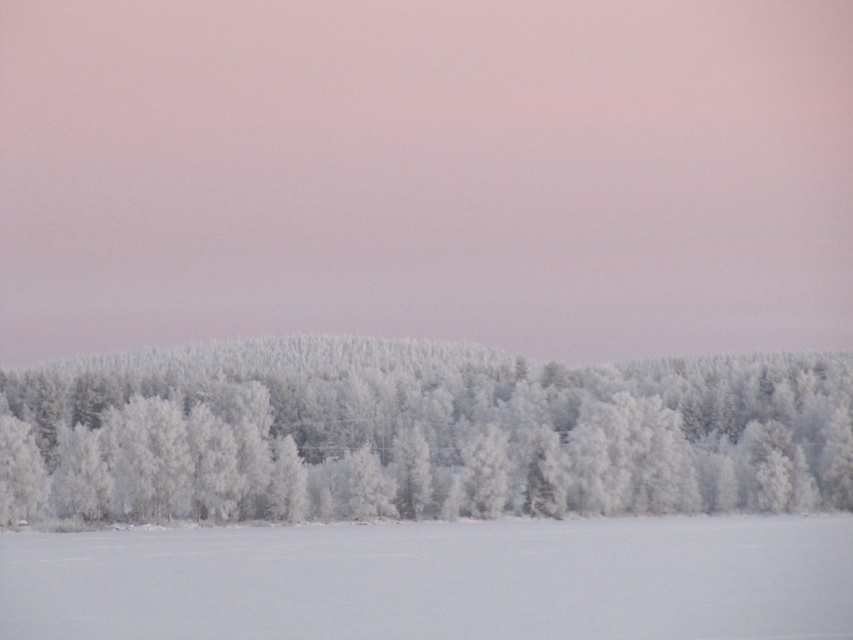
Question: Can you confirm if frosted white trees at center is positioned to the left of white frosty snow at lower center?

Choices:
 (A) no
 (B) yes

Answer: (B)

Question: Which point is closer to the camera?

Choices:
 (A) white frosty snow at lower center
 (B) frosted white trees at center

Answer: (A)

Question: Considering the relative positions of frosted white trees at center and white frosty snow at lower center in the image provided, where is frosted white trees at center located with respect to white frosty snow at lower center?

Choices:
 (A) above
 (B) below

Answer: (A)

Question: Among these points, which one is nearest to the camera?

Choices:
 (A) (1, 538)
 (B) (321, 356)

Answer: (A)

Question: Is frosted white trees at center closer to camera compared to white frosty snow at lower center?

Choices:
 (A) no
 (B) yes

Answer: (A)